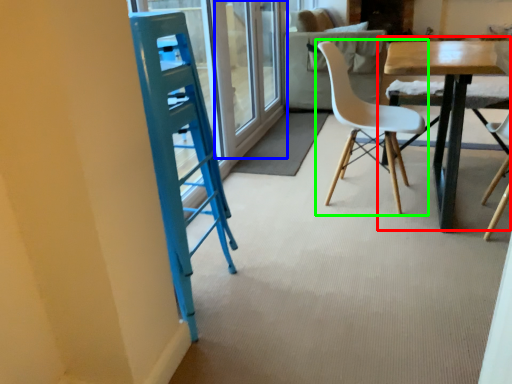
Question: Which object is the farthest from table (highlighted by a red box)? Choose among these: screen door (highlighted by a blue box) or chair (highlighted by a green box).

Choices:
 (A) screen door
 (B) chair

Answer: (A)